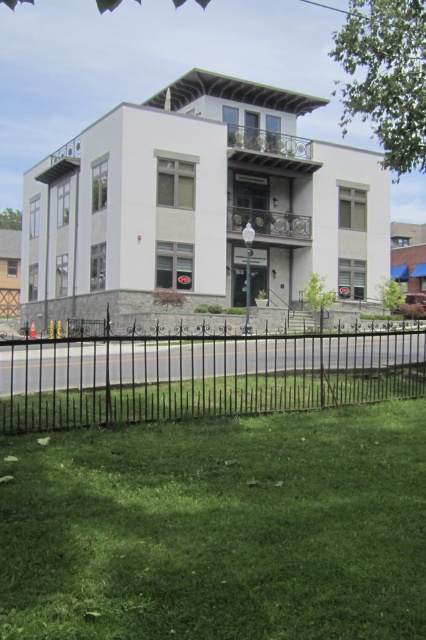
Measure the distance between green grass at lower center and black wrought iron fence at lower center.

The distance of green grass at lower center from black wrought iron fence at lower center is 10.20 meters.

Between green grass at lower center and black wrought iron fence at lower center, which one has less height?

With less height is green grass at lower center.

Is point (379, 428) closer to camera compared to point (356, 352)?

Yes, point (379, 428) is closer to viewer.

Where is `green grass at lower center`? This screenshot has height=640, width=426. green grass at lower center is located at coordinates (218, 529).